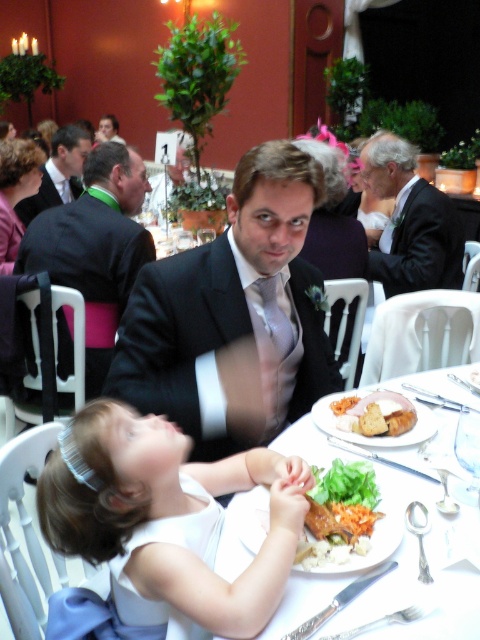
Question: Which point appears farthest from the camera in this image?

Choices:
 (A) (74, 518)
 (B) (54, 141)

Answer: (B)

Question: Which object is the closest to the white matte plate at lower center?

Choices:
 (A) matte black suit at upper right
 (B) shiny black suit at center
 (C) green leafy lettuce at center
 (D) brown crusty bread at lower center

Answer: (C)

Question: Does matte black suit at center have a lesser width compared to green leafy lettuce at center?

Choices:
 (A) no
 (B) yes

Answer: (A)

Question: Which point appears farthest from the camera in this image?

Choices:
 (A) (24, 204)
 (B) (271, 163)

Answer: (A)

Question: Does green leafy lettuce at center appear on the left side of matte black dress at upper center?

Choices:
 (A) yes
 (B) no

Answer: (B)

Question: Is white satin dress at lower left smaller than green leafy lettuce at center?

Choices:
 (A) no
 (B) yes

Answer: (A)